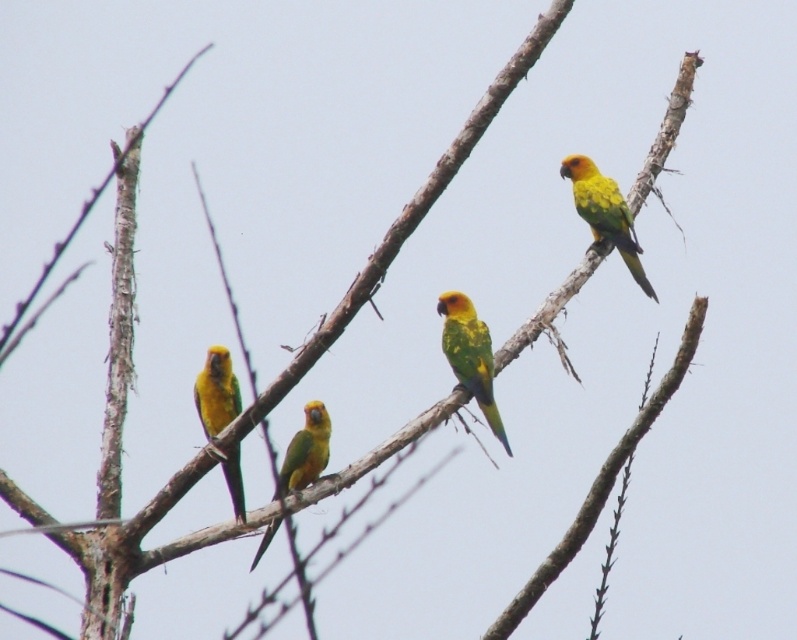
Who is lower down, yellow-green parrot at center or yellow-green glossy parrot at center?

yellow-green glossy parrot at center

Does point (489, 378) come closer to viewer compared to point (324, 458)?

No, (489, 378) is further to viewer.

Image resolution: width=797 pixels, height=640 pixels. What do you see at coordinates (470, 355) in the screenshot?
I see `yellow-green parrot at center` at bounding box center [470, 355].

Locate an element on the screen. Image resolution: width=797 pixels, height=640 pixels. yellow-green parrot at center is located at coordinates (470, 355).

Who is more forward, [197,403] or [326,460]?

Point [197,403]

The height and width of the screenshot is (640, 797). Describe the element at coordinates (216, 392) in the screenshot. I see `yellow-green parrot at left` at that location.

Locate an element on the screen. yellow-green parrot at left is located at coordinates (216, 392).

Consider the image. Can you confirm if yellow-green parrot at center is positioned above yellow-green parrot at upper right?

No.

Is yellow-green parrot at center in front of yellow-green parrot at upper right?

Yes.

Between point (476, 346) and point (654, 292), which one is positioned in front?

Point (476, 346)

In order to click on yellow-green parrot at center in this screenshot , I will do `click(470, 355)`.